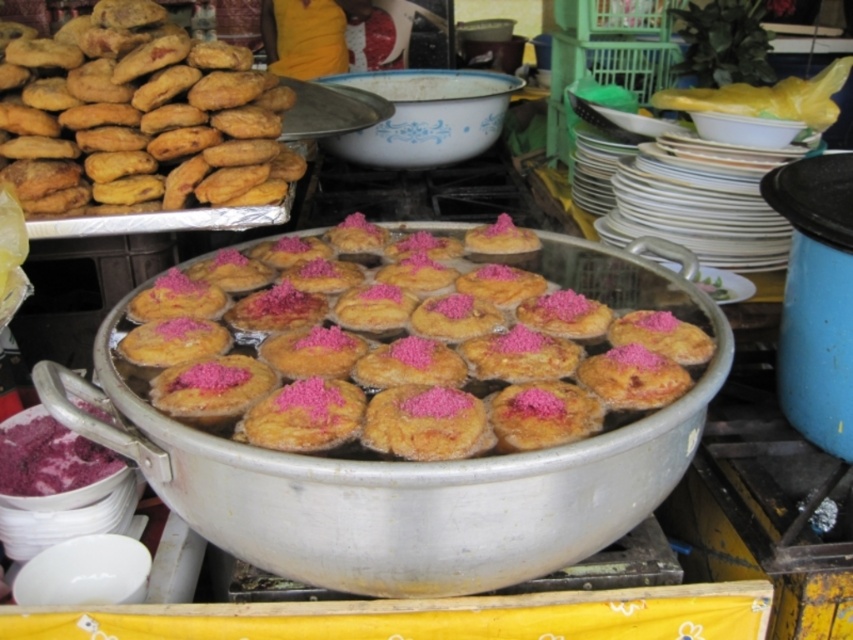
You are a customer at the market and want to know which item is taller between the pink sugary treats at center and the purple powder at lower left. Can you tell me?

The pink sugary treats at center are taller than the purple powder at lower left.

You are a customer at the market and want to find the pink sugary treats at center. Based on the coordinates provided, where should you look relative to the other items in the scene?

The pink sugary treats at center are located at coordinates point (412,353), which is slightly to the right and above the center point of the scene.

You are a customer standing in front of the food stall. The vendor tells you that the pastries on the metal tray are 1.2 meters away from you. Can you reach the pastries at point (323, 397) without moving closer?

The distance of point (323, 397) from the camera is 1.32 meters, so the pastries at that point are 1.32 meters away. Since the vendor mentioned the pastries are 1.2 meters away, you are 0.12 meters too far to reach them without moving closer.